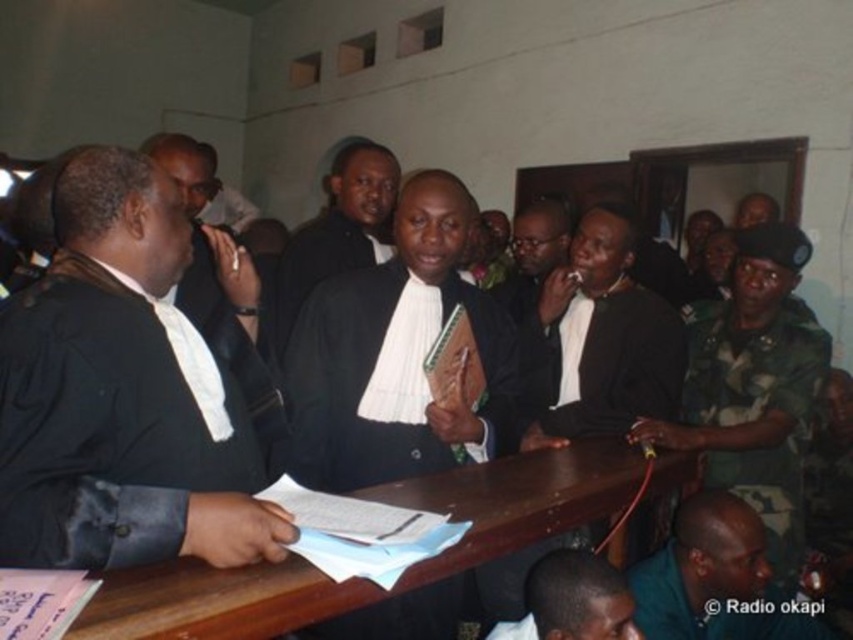
Question: Does black matte suit at center appear under white textured robe at center?

Choices:
 (A) yes
 (B) no

Answer: (A)

Question: Estimate the real-world distances between objects in this image. Which object is closer to the black matte suit at center?

Choices:
 (A) dark skin bald head at lower center
 (B) brown wood table at center

Answer: (B)

Question: Estimate the real-world distances between objects in this image. Which object is closer to the black satin robe at left?

Choices:
 (A) brown wood table at center
 (B) camo uniform at right
 (C) black matte suit at center

Answer: (A)

Question: Which object is positioned closest to the dark skin bald head at lower center?

Choices:
 (A) black matte suit at center
 (B) brown wood table at center

Answer: (B)

Question: Does black satin robe at left lie in front of brown wood table at center?

Choices:
 (A) yes
 (B) no

Answer: (B)

Question: Can you confirm if dark green uniform at lower right is positioned to the right of dark skin bald head at lower center?

Choices:
 (A) yes
 (B) no

Answer: (A)